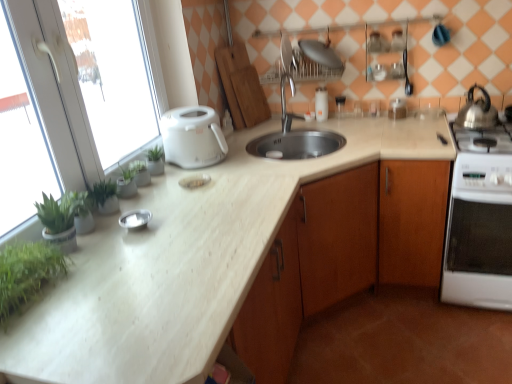
Where is `vacant space in between green leafy plant at left and white glossy salt shaker at upper center, the second appliance in the top-to-bottom sequence`? vacant space in between green leafy plant at left and white glossy salt shaker at upper center, the second appliance in the top-to-bottom sequence is located at coordinates pos(198,191).